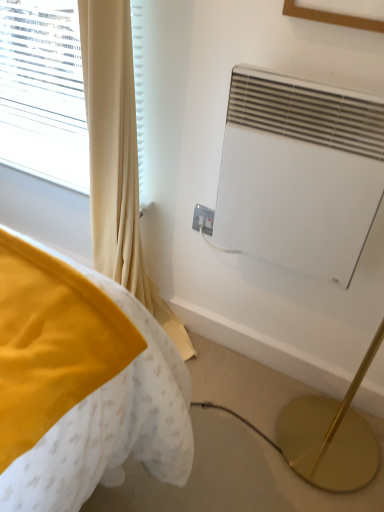
Question: Would you say beige fabric curtain at left is inside or outside white matte air conditioner at upper right?

Choices:
 (A) inside
 (B) outside

Answer: (B)

Question: From the image's perspective, is beige fabric curtain at left located above or below white matte air conditioner at upper right?

Choices:
 (A) above
 (B) below

Answer: (A)

Question: Estimate the real-world distances between objects in this image. Which object is closer to the white matte air conditioner at upper right?

Choices:
 (A) beige fabric curtain at left
 (B) white plastic electric outlet at center
 (C) wooden picture frame at upper center

Answer: (C)

Question: Which is farther from the white plastic electric outlet at center?

Choices:
 (A) white matte air conditioner at upper right
 (B) wooden picture frame at upper center
 (C) beige fabric curtain at left

Answer: (B)